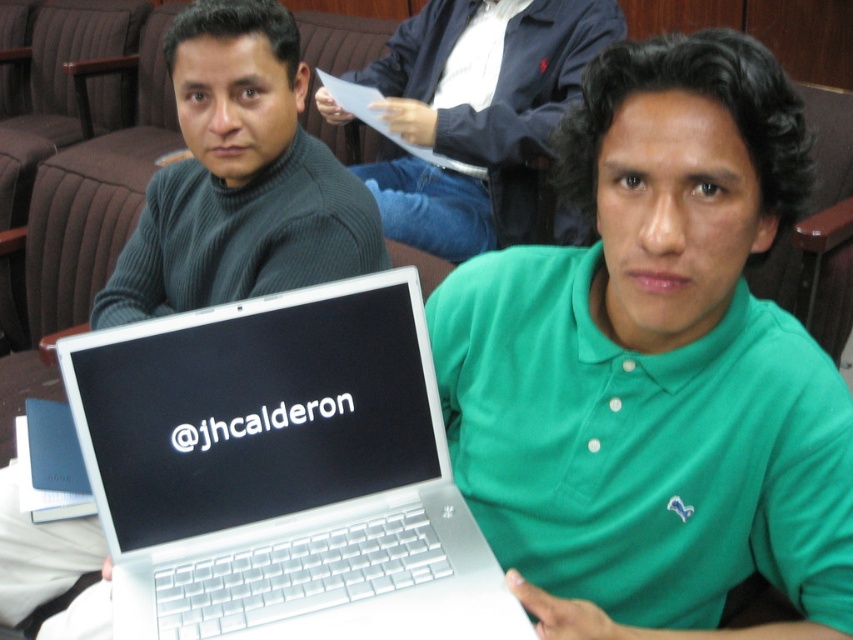
You are a photographer setting up for a group photo in the classroom. You want to ensure that both the silver metallic laptop at center and the matte gray sweater at left are clearly visible in the shot. Given their positions, which object should you focus on first to ensure both are in focus?

The silver metallic laptop at center is in front of the matte gray sweater at left. To ensure both are in focus, you should focus on the matte gray sweater at left first since it is further back, allowing the depth of field to cover the closer laptop as well.

You are organizing a photo shoot and need to place a 12 inch wide prop between the silver metallic laptop at center and the matte gray sweater at left. Based on their sizes, will the prop fit between them without overlapping?

The silver metallic laptop at center is smaller than the matte gray sweater at left. Therefore, the 12 inch wide prop may not fit between them as the distance between the two objects is likely less than 12 inches.

You are organizing a photo shoot and need to ensure that all participants are visible in the frame. Given that the matte gray sweater at left and the dark blue jacket at upper center are part of the scene, which one might require more space in the composition to accommodate its size?

The dark blue jacket at upper center requires more space in the composition because it is larger than the matte gray sweater at left.